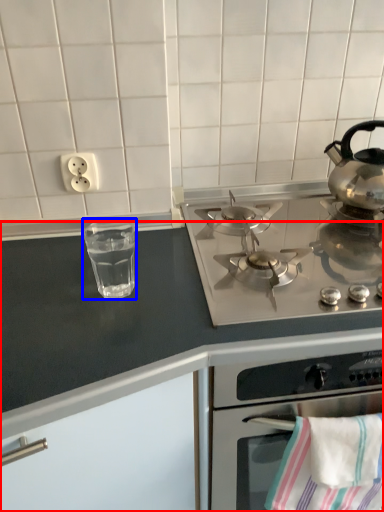
Question: Which object appears farthest to the camera in this image, countertop (highlighted by a red box) or glass jar (highlighted by a blue box)?

Choices:
 (A) countertop
 (B) glass jar

Answer: (B)